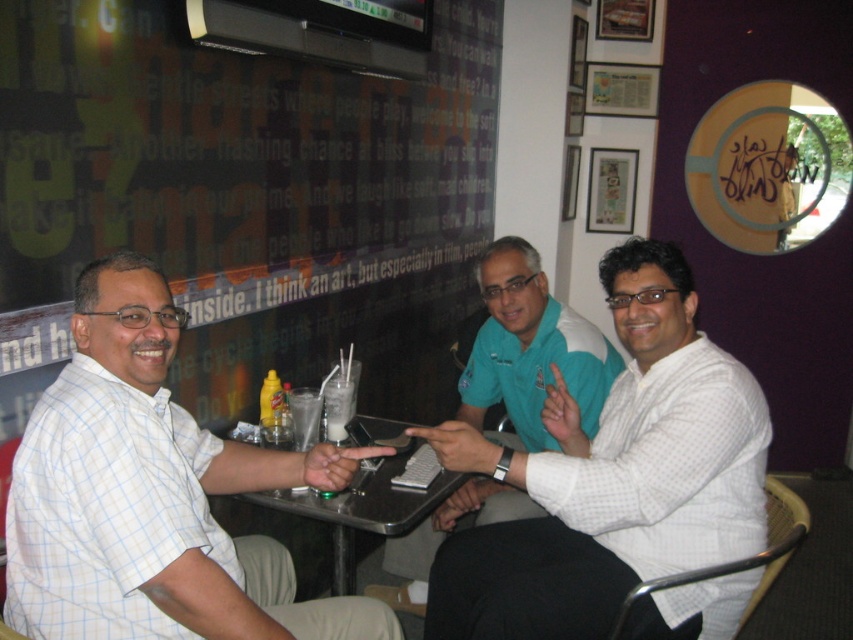
Question: Which is farther from the white checkered shirt at left?

Choices:
 (A) white checkered shirt at center
 (B) teal fabric shirt at center

Answer: (B)

Question: Can you confirm if white checkered shirt at left is smaller than milky white smoothie at center?

Choices:
 (A) no
 (B) yes

Answer: (A)

Question: Observing the image, what is the correct spatial positioning of teal fabric shirt at center in reference to metallic silver tray at center?

Choices:
 (A) above
 (B) below

Answer: (A)

Question: Can you confirm if teal fabric shirt at center is thinner than milky white smoothie at center?

Choices:
 (A) yes
 (B) no

Answer: (B)

Question: Which object is the closest to the teal fabric shirt at center?

Choices:
 (A) white frothy milkshake at center
 (B) white checkered shirt at center

Answer: (B)

Question: Which point is closer to the camera?

Choices:
 (A) (535, 426)
 (B) (544, 474)
 (C) (376, 429)

Answer: (B)